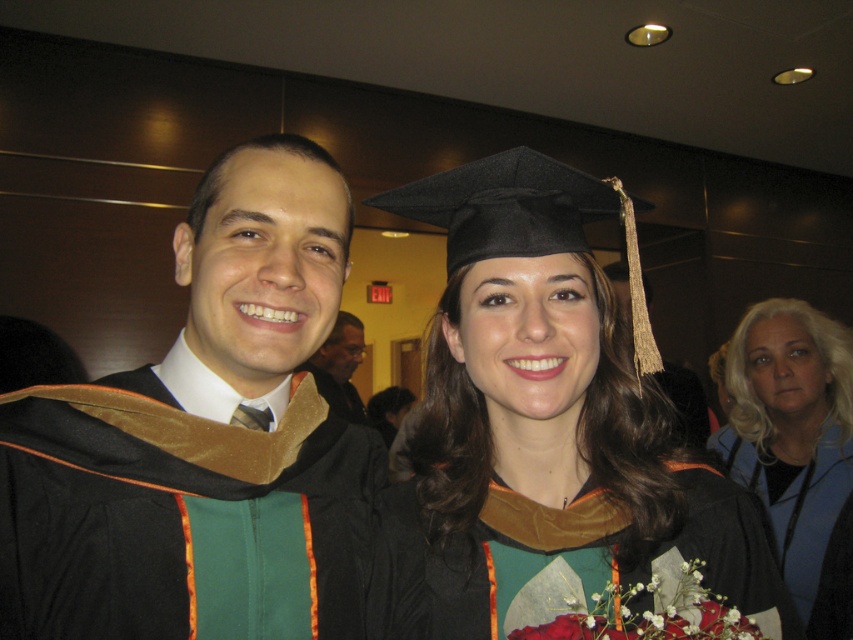
Is blonde hair at upper right to the left of matte black graduation gown at center from the viewer's perspective?

In fact, blonde hair at upper right is to the right of matte black graduation gown at center.

Does point (817, 456) come closer to viewer compared to point (326, 365)?

That is True.

This screenshot has width=853, height=640. Find the location of `blonde hair at upper right`. blonde hair at upper right is located at coordinates (796, 449).

Which is below, velvet-like black gown at center or matte black graduation gown at center?

velvet-like black gown at center is lower down.

The height and width of the screenshot is (640, 853). What do you see at coordinates (563, 561) in the screenshot? I see `velvet-like black gown at center` at bounding box center [563, 561].

This screenshot has height=640, width=853. I want to click on velvet-like black gown at center, so click(563, 561).

You are a GUI agent. You are given a task and a screenshot of the screen. Output one action in this format:
    pyautogui.click(x=<x>, y=<y>)
    Task: Click on the velvet-like black gown at center
    The height and width of the screenshot is (640, 853).
    Given the screenshot: What is the action you would take?
    coord(563,561)

Can you confirm if matte black graduation cap at center is smaller than matte black graduation gown at center?

Indeed, matte black graduation cap at center has a smaller size compared to matte black graduation gown at center.

Measure the distance from matte black graduation cap at center to matte black graduation gown at center.

matte black graduation cap at center and matte black graduation gown at center are 2.19 meters apart from each other.

What are the coordinates of `matte black graduation cap at center` in the screenshot? It's located at (543, 428).